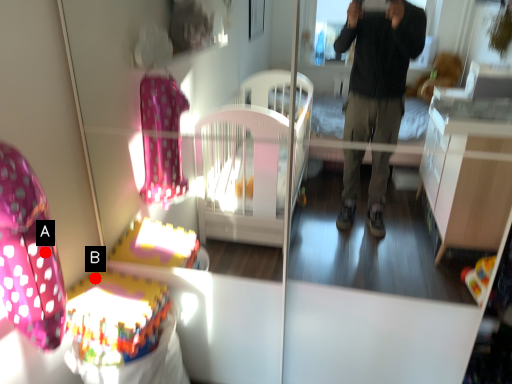
Question: Two points are circled on the image, labeled by A and B beside each circle. Which point appears closest to the camera in this image?

Choices:
 (A) A is closer
 (B) B is closer

Answer: (A)